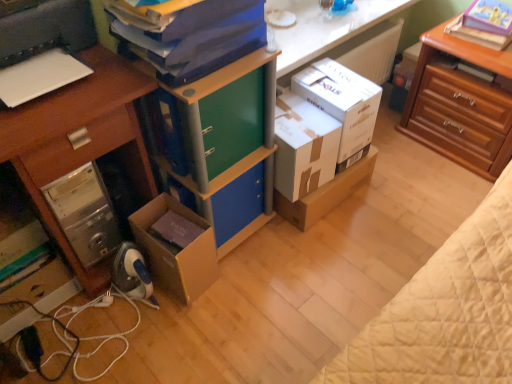
Question: Is white glossy counter top at upper center not within white cardboard box at center, placed as the second box when sorted from right to left?

Choices:
 (A) yes
 (B) no

Answer: (A)

Question: Does white glossy counter top at upper center appear on the right side of white cardboard box at center, placed as the second box when sorted from right to left?

Choices:
 (A) yes
 (B) no

Answer: (A)

Question: From a real-world perspective, is white glossy counter top at upper center positioned under white cardboard box at center, placed as the second box when sorted from right to left, based on gravity?

Choices:
 (A) yes
 (B) no

Answer: (B)

Question: Can you confirm if white glossy counter top at upper center is wider than white cardboard box at center, placed as the second box when sorted from right to left?

Choices:
 (A) no
 (B) yes

Answer: (B)

Question: From the image's perspective, is white glossy counter top at upper center below white cardboard box at center, placed as the second box when sorted from right to left?

Choices:
 (A) no
 (B) yes

Answer: (A)

Question: Does white glossy counter top at upper center have a greater height compared to white cardboard box at center, placed as the second box when sorted from right to left?

Choices:
 (A) no
 (B) yes

Answer: (A)

Question: Considering the relative sizes of cardboard box at lower left, acting as the 1th box starting from the left, and wooden nightstand at upper right in the image provided, is cardboard box at lower left, acting as the 1th box starting from the left, wider than wooden nightstand at upper right?

Choices:
 (A) yes
 (B) no

Answer: (B)

Question: Considering the relative sizes of cardboard box at lower left, acting as the 1th box starting from the left, and wooden nightstand at upper right in the image provided, is cardboard box at lower left, acting as the 1th box starting from the left, taller than wooden nightstand at upper right?

Choices:
 (A) yes
 (B) no

Answer: (B)

Question: Is cardboard box at lower left, acting as the 3th box starting from the right, not near wooden nightstand at upper right?

Choices:
 (A) no
 (B) yes

Answer: (B)

Question: Considering the relative positions of cardboard box at lower left, acting as the 1th box starting from the left, and wooden nightstand at upper right in the image provided, is cardboard box at lower left, acting as the 1th box starting from the left, to the right of wooden nightstand at upper right from the viewer's perspective?

Choices:
 (A) yes
 (B) no

Answer: (B)

Question: From a real-world perspective, does cardboard box at lower left, acting as the 1th box starting from the left, sit lower than wooden nightstand at upper right?

Choices:
 (A) yes
 (B) no

Answer: (A)

Question: Considering the relative sizes of cardboard box at lower left, acting as the 1th box starting from the left, and wooden nightstand at upper right in the image provided, is cardboard box at lower left, acting as the 1th box starting from the left, shorter than wooden nightstand at upper right?

Choices:
 (A) no
 (B) yes

Answer: (B)

Question: Is blue matte folder at upper center a part of white plastic printer at left?

Choices:
 (A) yes
 (B) no

Answer: (B)